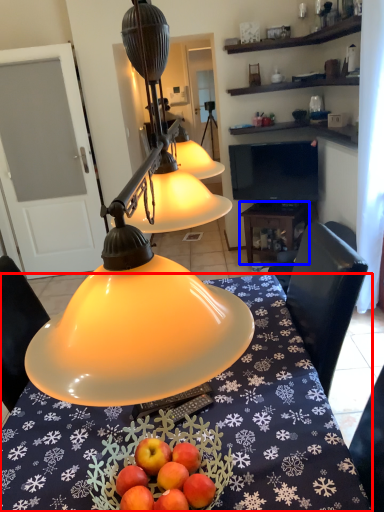
Question: Which of the following is the farthest to the observer, desk (highlighted by a red box) or table (highlighted by a blue box)?

Choices:
 (A) desk
 (B) table

Answer: (B)